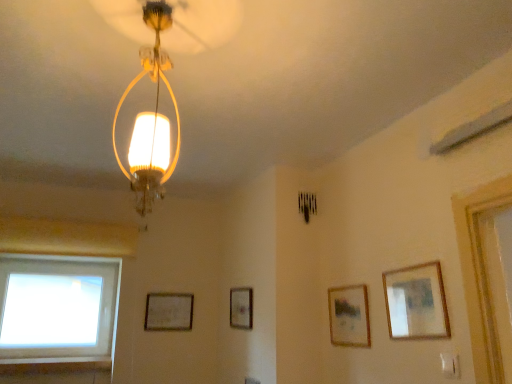
Measure the distance between transparent glass window at lower left and camera.

A: transparent glass window at lower left is 8.64 feet from camera.

What is the approximate width of wooden framed picture at center right, arranged as the 3th picture frame when viewed from the left?

0.87 inches.

This screenshot has height=384, width=512. In order to click on wooden framed picture at center right, which is counted as the 3th picture frame, starting from the back in this screenshot , I will do `click(349, 316)`.

Measure the distance between wooden framed picture at center, which appears as the third picture frame when viewed from the front, and camera.

wooden framed picture at center, which appears as the third picture frame when viewed from the front, and camera are 2.48 meters apart.

What is the approximate height of wooden picture frame at upper right, the fourth picture frame in the left-to-right sequence?

wooden picture frame at upper right, the fourth picture frame in the left-to-right sequence, is 11.29 inches in height.

Describe the element at coordinates (416, 302) in the screenshot. I see `wooden picture frame at upper right, which is counted as the 4th picture frame, starting from the back` at that location.

The image size is (512, 384). Identify the location of transparent glass window at lower left. (57, 308).

Considering the positions of objects matte glass lampshade at upper center and transparent glass window at lower left in the image provided, who is more to the left, matte glass lampshade at upper center or transparent glass window at lower left?

transparent glass window at lower left.

Is matte glass lampshade at upper center facing towards transparent glass window at lower left?

Yes, matte glass lampshade at upper center is oriented towards transparent glass window at lower left.

How distant is matte glass lampshade at upper center from transparent glass window at lower left?

matte glass lampshade at upper center and transparent glass window at lower left are 6.47 feet apart from each other.

You are a GUI agent. You are given a task and a screenshot of the screen. Output one action in this format:
    pyautogui.click(x=<x>, y=<y>)
    Task: Click on the window on the left of matte glass lampshade at upper center
    The width and height of the screenshot is (512, 384).
    Given the screenshot: What is the action you would take?
    pyautogui.click(x=57, y=308)

Is wooden framed picture at center, acting as the second picture frame starting from the back, a part of matte glass lampshade at upper center?

No, wooden framed picture at center, acting as the second picture frame starting from the back, is not inside matte glass lampshade at upper center.

From the image's perspective, is matte glass lampshade at upper center under wooden framed picture at center, acting as the second picture frame starting from the back?

Actually, matte glass lampshade at upper center appears above wooden framed picture at center, acting as the second picture frame starting from the back, in the image.

In terms of height, does matte glass lampshade at upper center look taller or shorter compared to wooden framed picture at center, which appears as the third picture frame when viewed from the front?

matte glass lampshade at upper center is taller than wooden framed picture at center, which appears as the third picture frame when viewed from the front.

Which of these two, matte glass lampshade at upper center or wooden framed picture at center, which appears as the third picture frame when viewed from the front, is wider?

matte glass lampshade at upper center is wider.

Is matte silver picture frame at lower left, the 4th picture frame when ordered from front to back, at the left side of transparent glass window at lower left?

Incorrect, matte silver picture frame at lower left, the 4th picture frame when ordered from front to back, is not on the left side of transparent glass window at lower left.

Is matte silver picture frame at lower left, the 1th picture frame when ordered from left to right, aimed at transparent glass window at lower left?

No, matte silver picture frame at lower left, the 1th picture frame when ordered from left to right, is not facing towards transparent glass window at lower left.

Which is farther, (166,319) or (76,267)?

The point (76,267) is behind.

Looking at this image, is matte silver picture frame at lower left, the 4th picture frame when ordered from front to back, not inside transparent glass window at lower left?

matte silver picture frame at lower left, the 4th picture frame when ordered from front to back, is positioned outside transparent glass window at lower left.

Is matte silver picture frame at lower left, placed as the 4th picture frame when sorted from right to left, next to wooden picture frame at upper right, acting as the 1th picture frame starting from the front, and touching it?

matte silver picture frame at lower left, placed as the 4th picture frame when sorted from right to left, and wooden picture frame at upper right, acting as the 1th picture frame starting from the front, are not in contact.

Considering the relative sizes of matte silver picture frame at lower left, the 4th picture frame when ordered from front to back, and wooden picture frame at upper right, marked as the 1th picture frame in a right-to-left arrangement, in the image provided, is matte silver picture frame at lower left, the 4th picture frame when ordered from front to back, bigger than wooden picture frame at upper right, marked as the 1th picture frame in a right-to-left arrangement,?

No.

Does matte silver picture frame at lower left, the first picture frame viewed from the back, have a greater height compared to wooden picture frame at upper right, which is counted as the 4th picture frame, starting from the back?

No.

Is matte silver picture frame at lower left, the first picture frame viewed from the back, located outside wooden picture frame at upper right, marked as the 1th picture frame in a right-to-left arrangement?

That's correct, matte silver picture frame at lower left, the first picture frame viewed from the back, is outside of wooden picture frame at upper right, marked as the 1th picture frame in a right-to-left arrangement.

Find the location of `the 4th picture frame directly beneath the transparent glass window at lower left (from a real-world perspective)`. the 4th picture frame directly beneath the transparent glass window at lower left (from a real-world perspective) is located at coordinates (349, 316).

Is transparent glass window at lower left looking in the opposite direction of wooden framed picture at center right, arranged as the 3th picture frame when viewed from the left?

No.

Which is more to the left, transparent glass window at lower left or wooden framed picture at center right, which ranks as the second picture frame in right-to-left order?

From the viewer's perspective, transparent glass window at lower left appears more on the left side.

Measure the distance from transparent glass window at lower left to wooden framed picture at center right, arranged as the 3th picture frame when viewed from the left.

A distance of 6.05 feet exists between transparent glass window at lower left and wooden framed picture at center right, arranged as the 3th picture frame when viewed from the left.

What's the angular difference between matte glass lampshade at upper center and wooden picture frame at upper right, marked as the 1th picture frame in a right-to-left arrangement,'s facing directions?

There is a 89-degree angle between the facing directions of matte glass lampshade at upper center and wooden picture frame at upper right, marked as the 1th picture frame in a right-to-left arrangement.

Is matte glass lampshade at upper center closer to camera compared to wooden picture frame at upper right, which is counted as the 4th picture frame, starting from the back?

That is True.

Can wooden picture frame at upper right, acting as the 1th picture frame starting from the front, be found inside matte glass lampshade at upper center?

No, wooden picture frame at upper right, acting as the 1th picture frame starting from the front, is not inside matte glass lampshade at upper center.

Between matte glass lampshade at upper center and wooden picture frame at upper right, marked as the 1th picture frame in a right-to-left arrangement, which one appears on the right side from the viewer's perspective?

wooden picture frame at upper right, marked as the 1th picture frame in a right-to-left arrangement, is more to the right.

Can you confirm if wooden framed picture at center, which is the third picture frame from right to left, is thinner than transparent glass window at lower left?

Correct, the width of wooden framed picture at center, which is the third picture frame from right to left, is less than that of transparent glass window at lower left.

Can you tell me how much wooden framed picture at center, which is the third picture frame from right to left, and transparent glass window at lower left differ in facing direction?

The facing directions of wooden framed picture at center, which is the third picture frame from right to left, and transparent glass window at lower left are 88.2 degrees apart.

The width and height of the screenshot is (512, 384). Identify the location of window behind the wooden framed picture at center, which is the third picture frame from right to left. (57, 308).

Image resolution: width=512 pixels, height=384 pixels. I want to click on window below the matte glass lampshade at upper center (from the image's perspective), so click(x=57, y=308).

Starting from the matte glass lampshade at upper center, which picture frame is the 3rd one behind? Please provide its 2D coordinates.

[(241, 308)]

When comparing their distances from wooden framed picture at center right, which is the second picture frame in front-to-back order, does wooden framed picture at center, which appears as the third picture frame when viewed from the front, or matte glass lampshade at upper center seem closer?

wooden framed picture at center, which appears as the third picture frame when viewed from the front, is closer to wooden framed picture at center right, which is the second picture frame in front-to-back order.

Based on their spatial positions, is wooden framed picture at center, which appears as the third picture frame when viewed from the front, or wooden picture frame at upper right, marked as the 1th picture frame in a right-to-left arrangement, further from matte silver picture frame at lower left, the 1th picture frame when ordered from left to right?

wooden picture frame at upper right, marked as the 1th picture frame in a right-to-left arrangement.

When comparing their distances from wooden framed picture at center, which is the third picture frame from right to left, does matte silver picture frame at lower left, the first picture frame viewed from the back, or wooden framed picture at center right, which is the second picture frame in front-to-back order, seem further?

wooden framed picture at center right, which is the second picture frame in front-to-back order, lies further to wooden framed picture at center, which is the third picture frame from right to left, than the other object.

Estimate the real-world distances between objects in this image. Which object is closer to matte glass lampshade at upper center, transparent glass window at lower left or wooden picture frame at upper right, which is counted as the 4th picture frame, starting from the back?

wooden picture frame at upper right, which is counted as the 4th picture frame, starting from the back.

Looking at the image, which one is located further to wooden picture frame at upper right, the fourth picture frame in the left-to-right sequence, transparent glass window at lower left or matte silver picture frame at lower left, the 4th picture frame when ordered from front to back?

transparent glass window at lower left is further to wooden picture frame at upper right, the fourth picture frame in the left-to-right sequence.

Looking at the image, which one is located closer to wooden framed picture at center right, which is counted as the 3th picture frame, starting from the back, transparent glass window at lower left or wooden framed picture at center, acting as the second picture frame starting from the back?

wooden framed picture at center, acting as the second picture frame starting from the back, lies closer to wooden framed picture at center right, which is counted as the 3th picture frame, starting from the back, than the other object.

From the image, which object appears to be nearer to wooden picture frame at upper right, marked as the 1th picture frame in a right-to-left arrangement, matte silver picture frame at lower left, the first picture frame viewed from the back, or matte glass lampshade at upper center?

Based on the image, matte glass lampshade at upper center appears to be nearer to wooden picture frame at upper right, marked as the 1th picture frame in a right-to-left arrangement.

Considering their positions, is wooden picture frame at upper right, marked as the 1th picture frame in a right-to-left arrangement, positioned closer to wooden framed picture at center right, arranged as the 3th picture frame when viewed from the left, than matte glass lampshade at upper center?

wooden picture frame at upper right, marked as the 1th picture frame in a right-to-left arrangement, lies closer to wooden framed picture at center right, arranged as the 3th picture frame when viewed from the left, than the other object.

Image resolution: width=512 pixels, height=384 pixels. In order to click on picture frame between wooden picture frame at upper right, marked as the 1th picture frame in a right-to-left arrangement, and wooden framed picture at center, which appears as the third picture frame when viewed from the front, from front to back in this screenshot , I will do 349,316.

Identify the location of window between matte glass lampshade at upper center and matte silver picture frame at lower left, placed as the 4th picture frame when sorted from right to left, along the z-axis. (57, 308).

In order to click on lamp between transparent glass window at lower left and wooden framed picture at center right, arranged as the 3th picture frame when viewed from the left, from left to right in this screenshot , I will do `click(150, 120)`.

The width and height of the screenshot is (512, 384). Find the location of `lamp located between transparent glass window at lower left and wooden picture frame at upper right, acting as the 1th picture frame starting from the front, in the left-right direction`. lamp located between transparent glass window at lower left and wooden picture frame at upper right, acting as the 1th picture frame starting from the front, in the left-right direction is located at coordinates (150, 120).